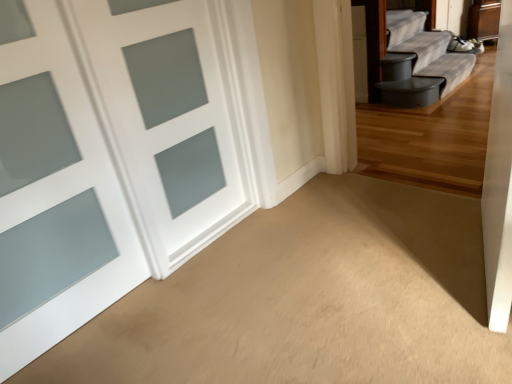
Question: Considering the positions of white frosted glass door at left, which is the 2th door from left to right, and satin white door at left, the first door in the left-to-right sequence, in the image, is white frosted glass door at left, which is the 2th door from left to right, taller or shorter than satin white door at left, the first door in the left-to-right sequence,?

Choices:
 (A) tall
 (B) short

Answer: (B)

Question: Is point (222, 102) positioned closer to the camera than point (10, 43)?

Choices:
 (A) closer
 (B) farther

Answer: (B)

Question: Is white frosted glass door at left, which is the 2th door from left to right, situated inside satin white door at left, acting as the second door starting from the right, or outside?

Choices:
 (A) inside
 (B) outside

Answer: (B)

Question: From the image's perspective, is satin white door at left, the first door in the left-to-right sequence, located above or below white frosted glass door at left, placed as the 1th door when sorted from right to left?

Choices:
 (A) below
 (B) above

Answer: (A)

Question: In the image, is satin white door at left, the first door in the left-to-right sequence, on the left side or the right side of white frosted glass door at left, which is the 2th door from left to right?

Choices:
 (A) left
 (B) right

Answer: (A)

Question: In terms of width, does satin white door at left, the first door in the left-to-right sequence, look wider or thinner when compared to white frosted glass door at left, placed as the 1th door when sorted from right to left?

Choices:
 (A) wide
 (B) thin

Answer: (B)

Question: Relative to white frosted glass door at left, placed as the 1th door when sorted from right to left, is satin white door at left, acting as the second door starting from the right, in front or behind?

Choices:
 (A) front
 (B) behind

Answer: (A)